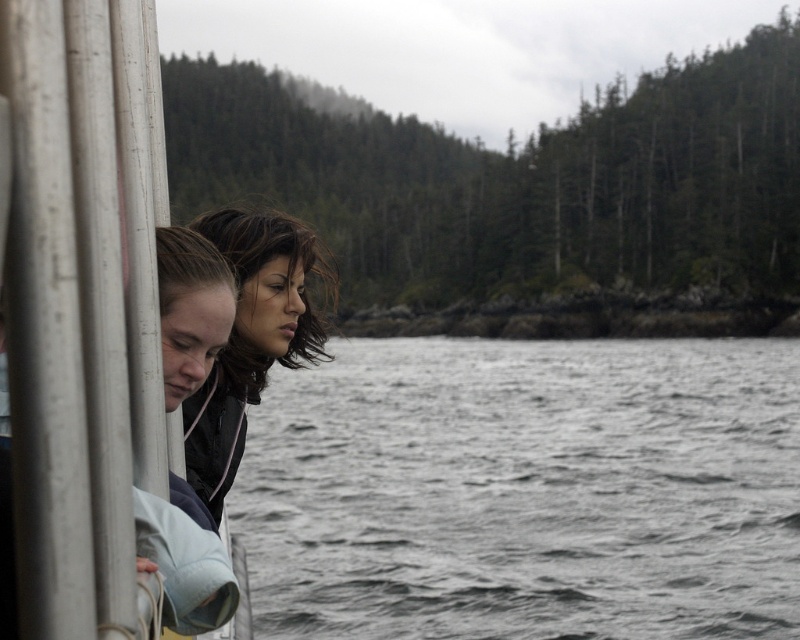
Question: Does gray water at center have a larger size compared to matte black jacket at center?

Choices:
 (A) yes
 (B) no

Answer: (A)

Question: Can you confirm if gray water at center is bigger than matte black jacket at center?

Choices:
 (A) no
 (B) yes

Answer: (B)

Question: Which object appears farthest from the camera in this image?

Choices:
 (A) gray water at center
 (B) metallic silver boat at left

Answer: (A)

Question: Which object is farther from the camera taking this photo?

Choices:
 (A) matte black jacket at center
 (B) metallic silver boat at left
 (C) gray water at center

Answer: (C)

Question: Which point is farther from the camera taking this photo?

Choices:
 (A) (325, 413)
 (B) (289, 278)

Answer: (A)

Question: Is metallic silver boat at left below matte black jacket at center?

Choices:
 (A) no
 (B) yes

Answer: (B)